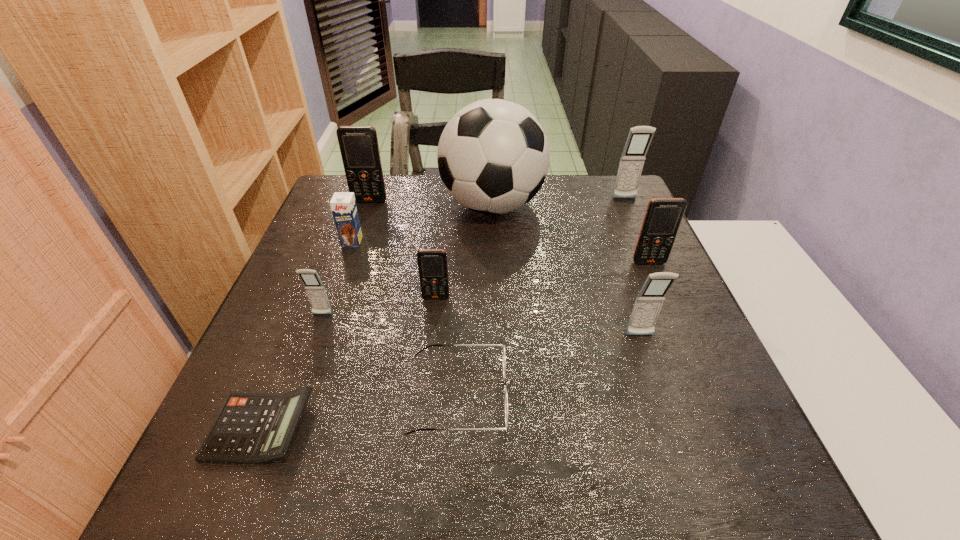
You are a GUI agent. You are given a task and a screenshot of the screen. Output one action in this format:
    pyautogui.click(x=<x>, y=<y>)
    Task: Click on the chocolate milk at the left edge
    
    Given the screenshot: What is the action you would take?
    pyautogui.click(x=343, y=204)

Locate an element on the screen. calculator at the left edge is located at coordinates (251, 428).

You are a GUI agent. You are given a task and a screenshot of the screen. Output one action in this format:
    pyautogui.click(x=<x>, y=<y>)
    Task: Click on the object located in the far left corner section of the desktop
    
    Given the screenshot: What is the action you would take?
    pyautogui.click(x=359, y=148)

You are a GUI agent. You are given a task and a screenshot of the screen. Output one action in this format:
    pyautogui.click(x=<x>, y=<y>)
    Task: Click on the object situated at the near left corner
    The image size is (960, 540).
    Given the screenshot: What is the action you would take?
    pyautogui.click(x=251, y=428)

Where is `object present at the far right corner`? This screenshot has height=540, width=960. object present at the far right corner is located at coordinates (632, 160).

In the image, there is a desktop. Where is `vacant space at the far edge`? Image resolution: width=960 pixels, height=540 pixels. vacant space at the far edge is located at coordinates (440, 183).

This screenshot has width=960, height=540. In order to click on vacant space at the near edge of the desktop in this screenshot , I will do `click(566, 468)`.

The image size is (960, 540). Identify the location of free space at the left edge of the desktop. coord(298,265).

What are the coordinates of `blank space at the right edge of the desktop` in the screenshot? It's located at (592, 228).

Locate an element on the screen. vacant space in between the tallest object and the second smallest orange cellular telephone is located at coordinates (570, 234).